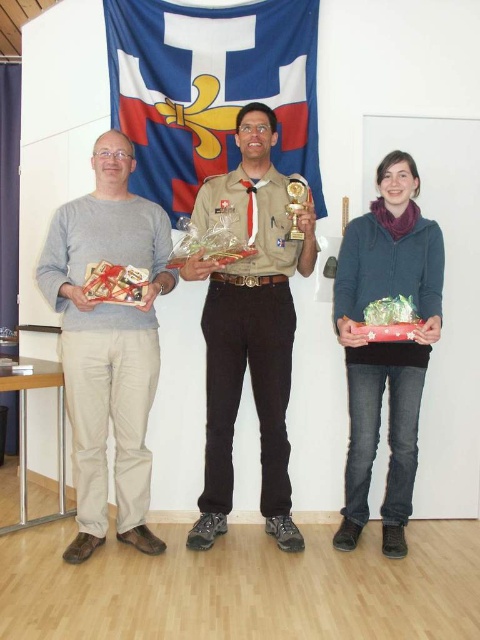
You are organizing a clothing donation drive and need to sort items by size. You have two sweaters in front of you, the matte gray sweater at center and the matte blue sweater at center. Which one should you place in the large size bin?

The matte gray sweater at center should be placed in the large size bin because it has a larger size compared to the matte blue sweater at center.